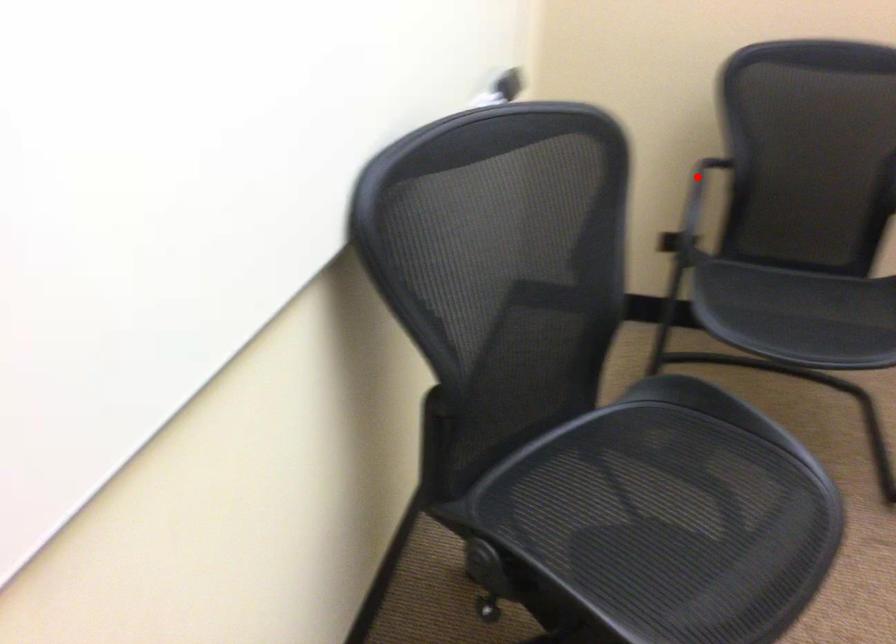
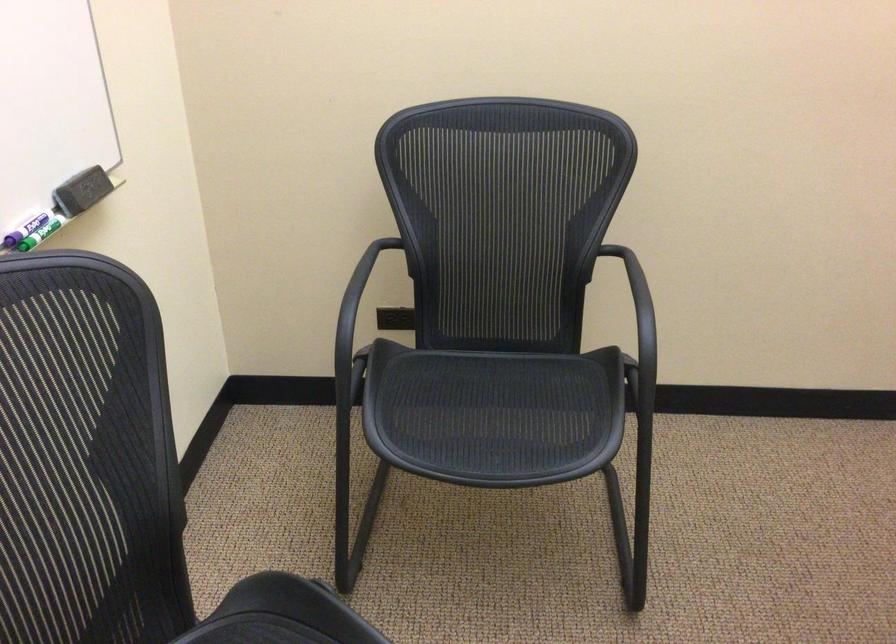
In the second image, find the point that corresponds to the highlighted location in the first image.

(360, 286)